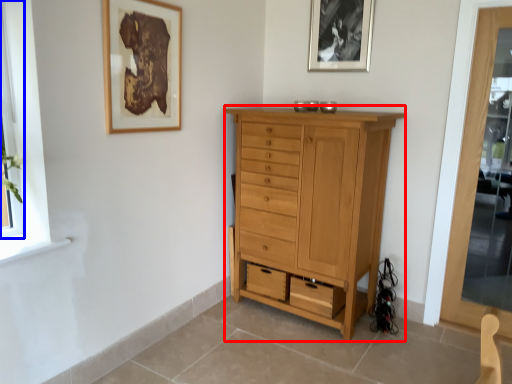
Question: Which object is closer to the camera taking this photo, chest of drawers (highlighted by a red box) or window (highlighted by a blue box)?

Choices:
 (A) chest of drawers
 (B) window

Answer: (B)